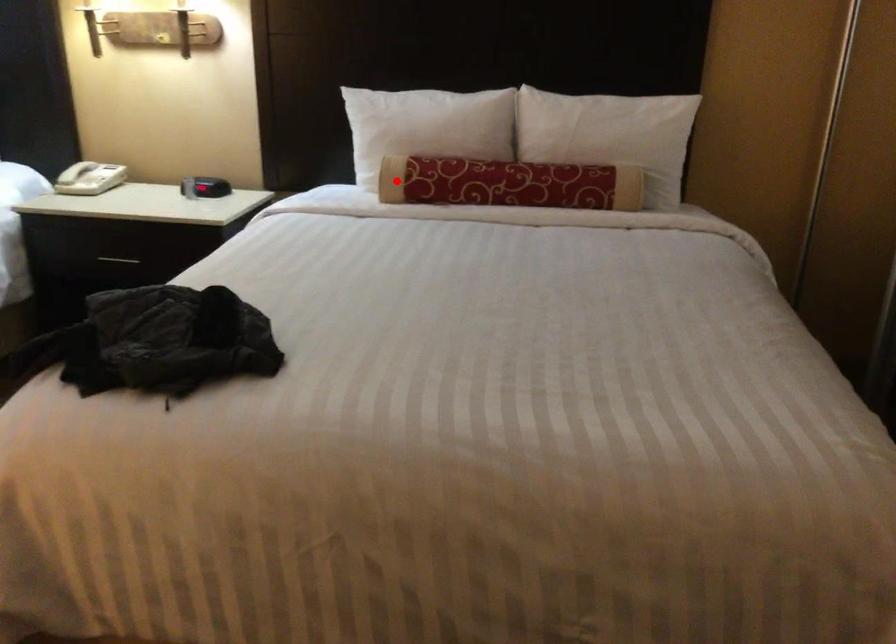
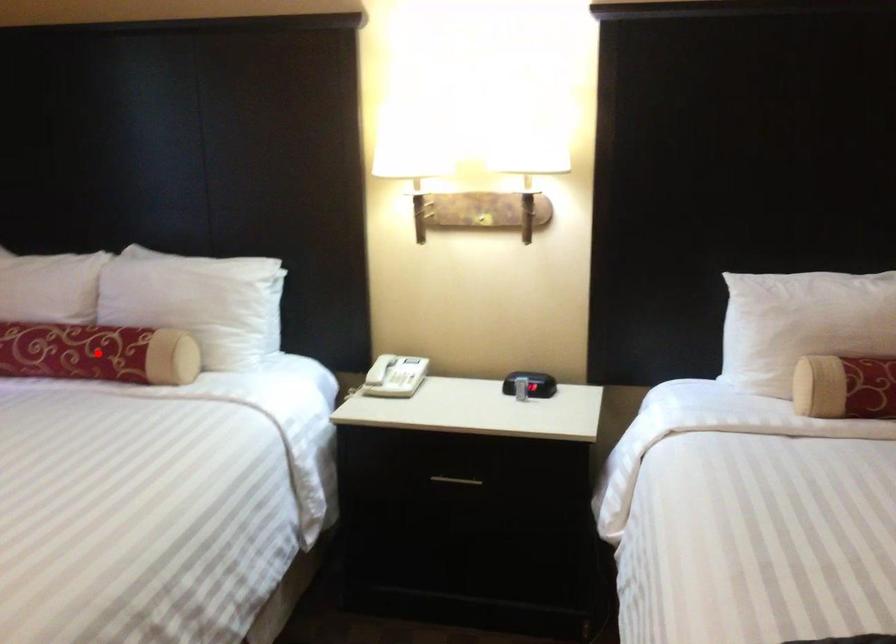
I am providing you with two images of the same scene from different viewpoints. A red point is marked on the first image and another point is marked on the second image. Is the marked point in image1 the same physical position as the marked point in image2?

No